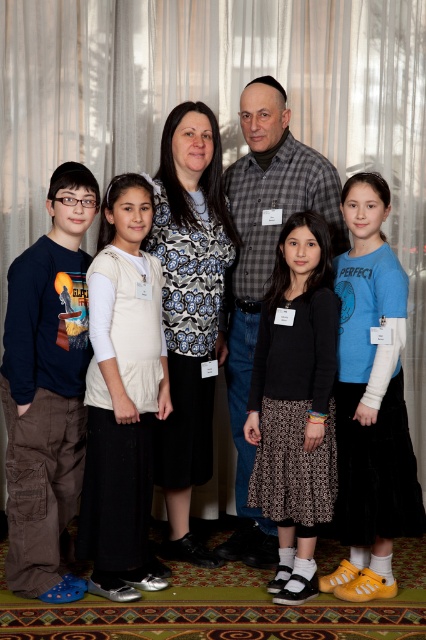
Question: Does blue velvety shirt at right appear under floral-patterned blouse at center?

Choices:
 (A) yes
 (B) no

Answer: (A)

Question: Does white cotton shirt at center appear under floral-patterned blouse at center?

Choices:
 (A) no
 (B) yes

Answer: (B)

Question: Which object appears farthest from the camera in this image?

Choices:
 (A) white cotton shirt at center
 (B) matte blue shirt at left

Answer: (A)

Question: Does blue velvety shirt at right have a greater width compared to checkered fabric shirt at center?

Choices:
 (A) no
 (B) yes

Answer: (A)

Question: Which object is farther from the camera taking this photo?

Choices:
 (A) floral-patterned blouse at center
 (B) checkered fabric shirt at center
 (C) white cotton shirt at center
 (D) matte blue shirt at left

Answer: (B)

Question: Considering the real-world distances, which object is closest to the blue velvety shirt at right?

Choices:
 (A) matte blue shirt at left
 (B) floral-patterned blouse at center
 (C) white cotton shirt at center
 (D) checkered fabric shirt at center

Answer: (D)